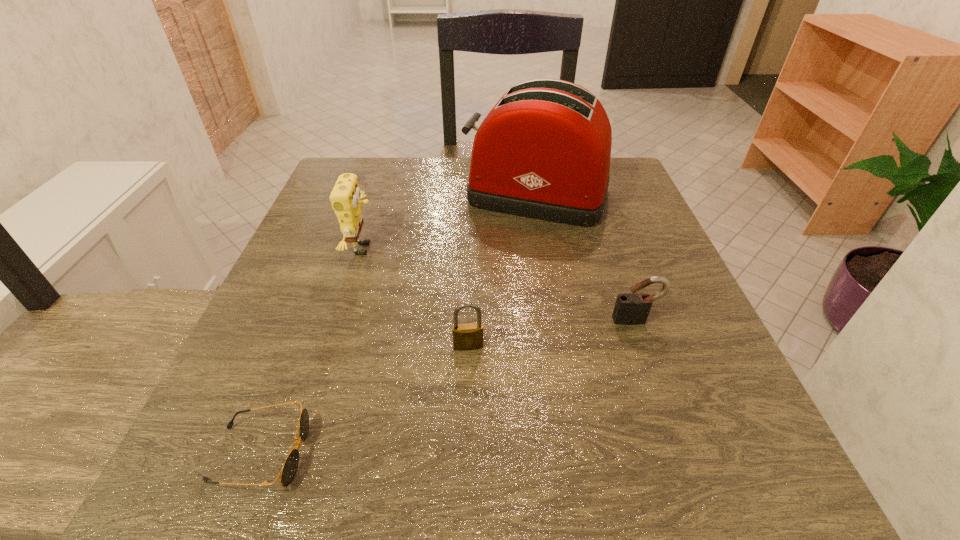
You are a GUI agent. You are given a task and a screenshot of the screen. Output one action in this format:
    pyautogui.click(x=<x>, y=<y>)
    Task: Click on the free location that satisfies the following two spatial constraints: 1. on the face of the nearer padlock; 2. on the right side of the fourth shortest object
    The image size is (960, 540).
    Given the screenshot: What is the action you would take?
    pyautogui.click(x=333, y=346)

Where is `free space that satisfies the following two spatial constraints: 1. on the face of the fourth farthest object; 2. on the left side of the fourth shortest object`? The image size is (960, 540). free space that satisfies the following two spatial constraints: 1. on the face of the fourth farthest object; 2. on the left side of the fourth shortest object is located at coordinates (333, 346).

Where is `free space that satisfies the following two spatial constraints: 1. on the front side of the left padlock; 2. on the lenses of the nearest object`? free space that satisfies the following two spatial constraints: 1. on the front side of the left padlock; 2. on the lenses of the nearest object is located at coordinates 466,453.